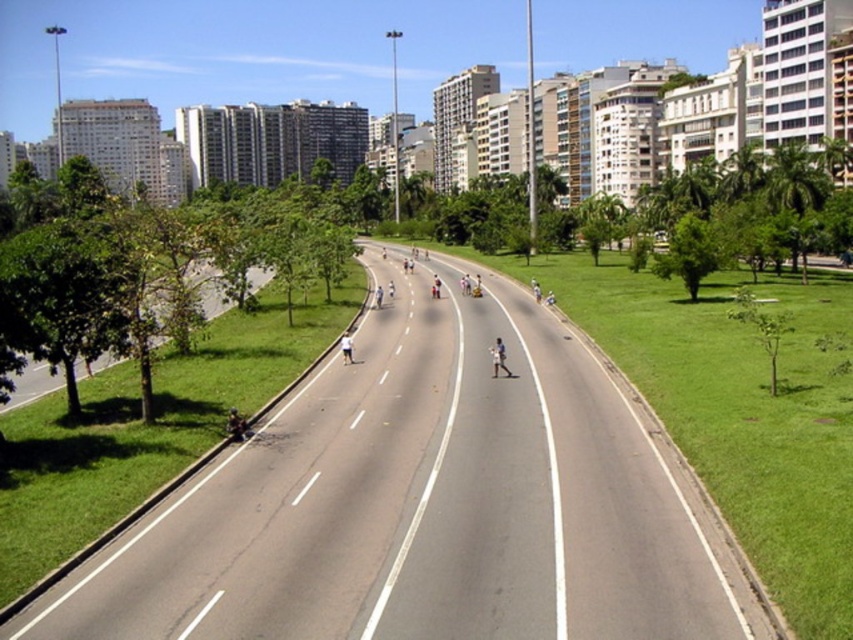
You are standing at the point with coordinates (427, 500) in the image. Based on the scene description, what surface are you currently standing on?

The point at (427, 500) indicates smooth asphalt road at center, so you are standing on the smooth asphalt road at center.

You are a pedestrian standing at the edge of the road and see the dark green fabric at center and the white matte person at center. Which object is nearer to you?

The dark green fabric at center is closer to the viewer than the white matte person at center.

You are standing at point (241, 435) and want to walk to point (537, 611). Given the road layout described, will you have to cross any lanes of the road to reach your destination?

Since point (537, 611) is in front of point (241, 435), you are moving in the same direction along the road without needing to cross any lanes. The path is straightforward along the pedestrian area.